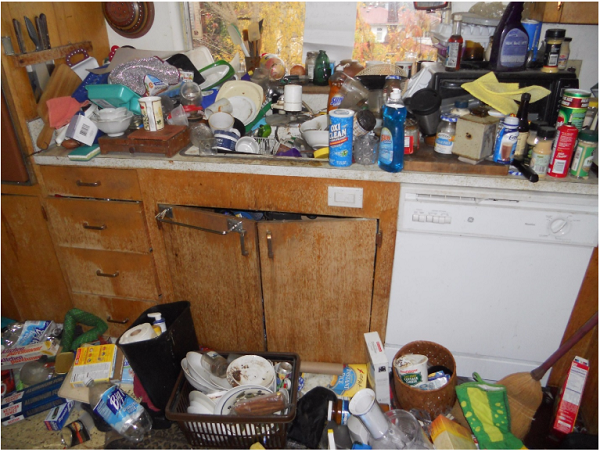
I want to click on curtain, so click(x=397, y=25), click(x=288, y=19).